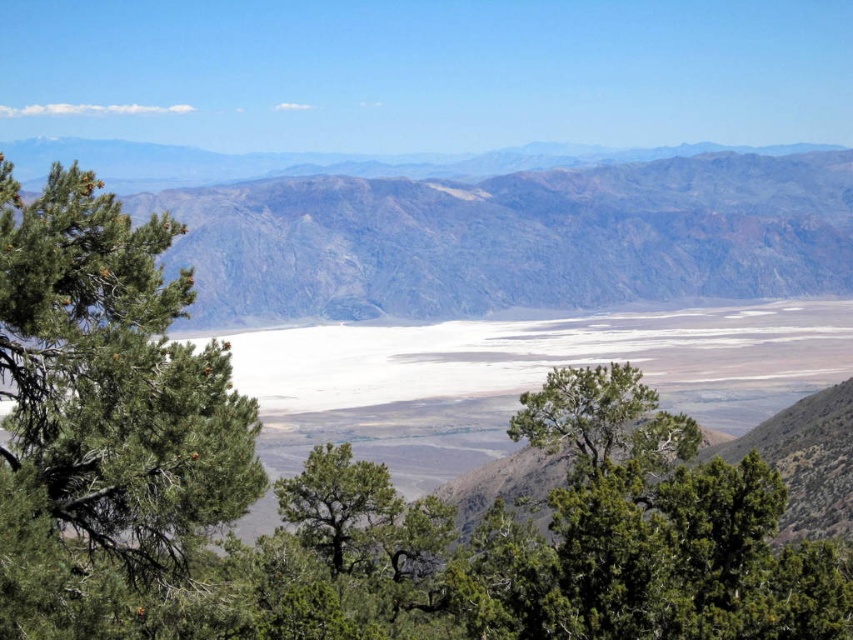
Which is in front, point (836, 257) or point (361, 504)?

Positioned in front is point (361, 504).

Based on the photo, who is taller, brown rocky mountain range at center or green leafy tree at center?

brown rocky mountain range at center

Is point (848, 289) positioned in front of point (328, 515)?

No.

Locate an element on the screen. This screenshot has height=640, width=853. brown rocky mountain range at center is located at coordinates (514, 237).

Can you confirm if green needle-like tree at center is smaller than green leafy tree at center?

Yes, green needle-like tree at center is smaller than green leafy tree at center.

Looking at this image, does green needle-like tree at center have a greater height compared to green leafy tree at center?

Incorrect, green needle-like tree at center's height is not larger of green leafy tree at center's.

You are a GUI agent. You are given a task and a screenshot of the screen. Output one action in this format:
    pyautogui.click(x=<x>, y=<y>)
    Task: Click on the green needle-like tree at center
    This screenshot has height=640, width=853.
    Given the screenshot: What is the action you would take?
    pyautogui.click(x=602, y=420)

Which of these two, green needle-like leaves at left or green needle-like tree at center, stands shorter?

With less height is green needle-like tree at center.

This screenshot has height=640, width=853. Describe the element at coordinates (107, 397) in the screenshot. I see `green needle-like leaves at left` at that location.

I want to click on green needle-like leaves at left, so click(x=107, y=397).